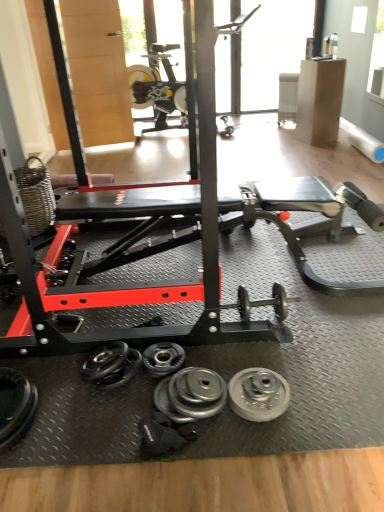
This screenshot has width=384, height=512. I want to click on vacant region to the right of silver metallic weight at center, arranged as the second wheel when viewed from the left, so (x=314, y=396).